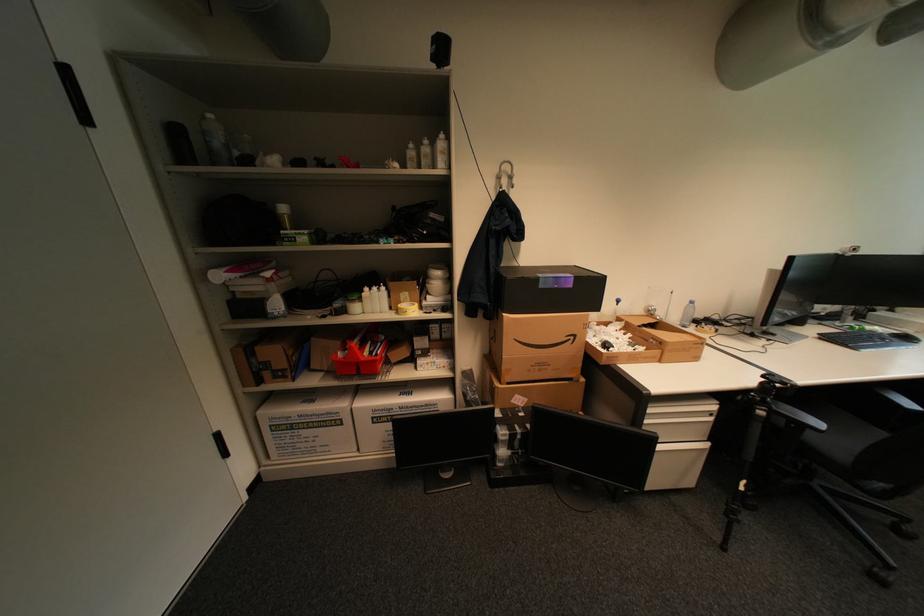
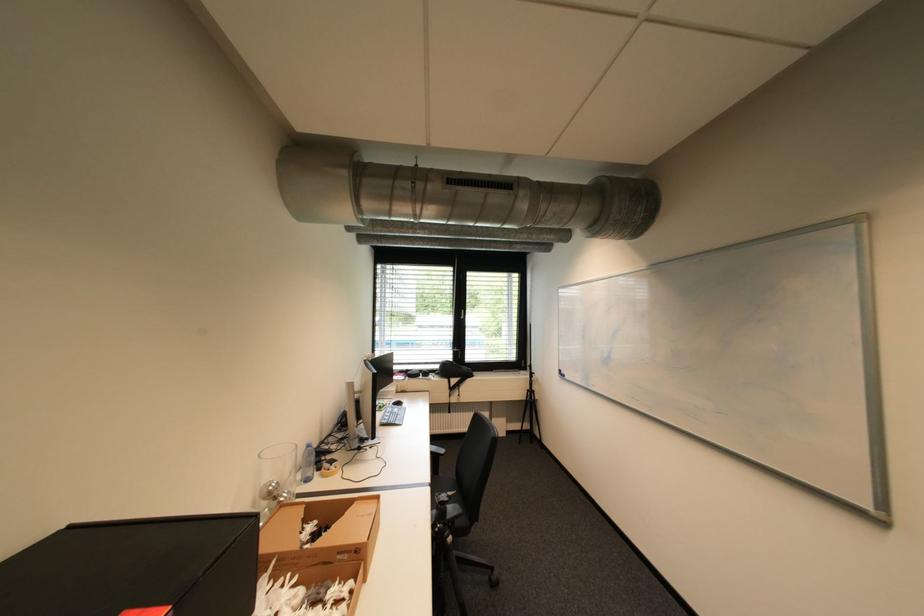
The point at [697,302] is marked in the first image. Where is the corresponding point in the second image?

(313, 448)